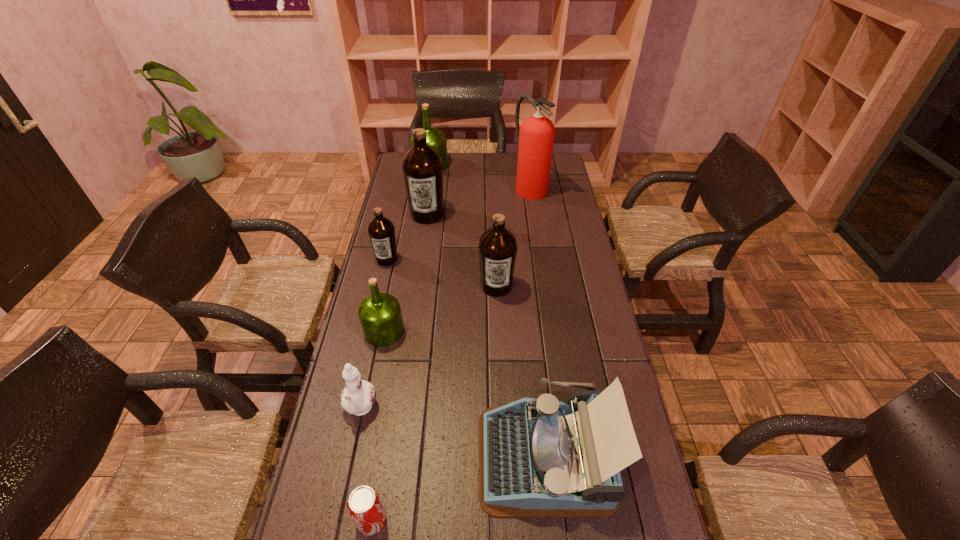
The width and height of the screenshot is (960, 540). I want to click on vacant point located between the rightmost olive oil and the nearer green olive oil, so click(441, 308).

I want to click on free space between the rightmost olive oil and the second farthest olive oil, so click(x=462, y=250).

You are a GUI agent. You are given a task and a screenshot of the screen. Output one action in this format:
    pyautogui.click(x=<x>, y=<y>)
    Task: Click on the vacant point located between the rightmost brown olive oil and the soda can
    
    Given the screenshot: What is the action you would take?
    pyautogui.click(x=434, y=403)

At what (x,y) coordinates should I click in order to perform the action: click on free space between the smaller green olive oil and the farthest brown olive oil. Please return your answer as a coordinate pair (x, y). This screenshot has height=540, width=960. Looking at the image, I should click on (406, 273).

In order to click on vacant region between the second nearest brown olive oil and the fire extinguisher in this screenshot , I will do `click(458, 222)`.

Where is `vacant space that's between the chinaware and the red fire extinguisher`? The width and height of the screenshot is (960, 540). vacant space that's between the chinaware and the red fire extinguisher is located at coordinates (445, 298).

The width and height of the screenshot is (960, 540). Find the location of `object that is the third closest to the second biggest brown olive oil`. object that is the third closest to the second biggest brown olive oil is located at coordinates (422, 167).

Select which object is the fifth closest to the blue typewriter. Please provide its 2D coordinates. Your answer should be formatted as a tuple, i.e. [(x, y)], where the tuple contains the x and y coordinates of a point satisfying the conditions above.

[(381, 231)]

Identify which olive oil is the second closest to the chinaware. Please provide its 2D coordinates. Your answer should be formatted as a tuple, i.e. [(x, y)], where the tuple contains the x and y coordinates of a point satisfying the conditions above.

[(497, 246)]

Select which olive oil is the closest to the smaller green olive oil. Please provide its 2D coordinates. Your answer should be formatted as a tuple, i.e. [(x, y)], where the tuple contains the x and y coordinates of a point satisfying the conditions above.

[(381, 231)]